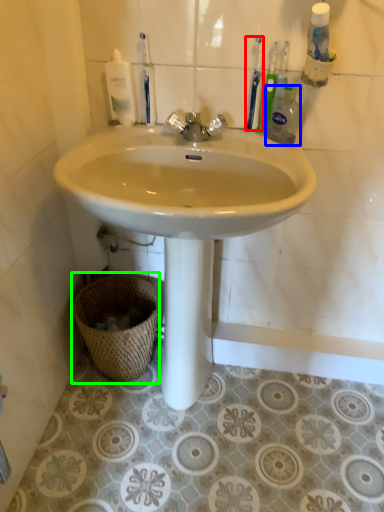
Question: Which object is the closest to the toothbrush (highlighted by a red box)? Choose among these: cleaning product (highlighted by a blue box) or basket (highlighted by a green box).

Choices:
 (A) cleaning product
 (B) basket

Answer: (A)